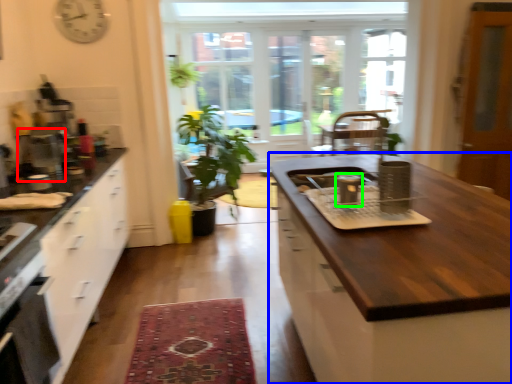
Question: Which object is positioned farthest from appliance (highlighted by a red box)? Select from cabinetry (highlighted by a blue box) and appliance (highlighted by a green box).

Choices:
 (A) cabinetry
 (B) appliance

Answer: (A)